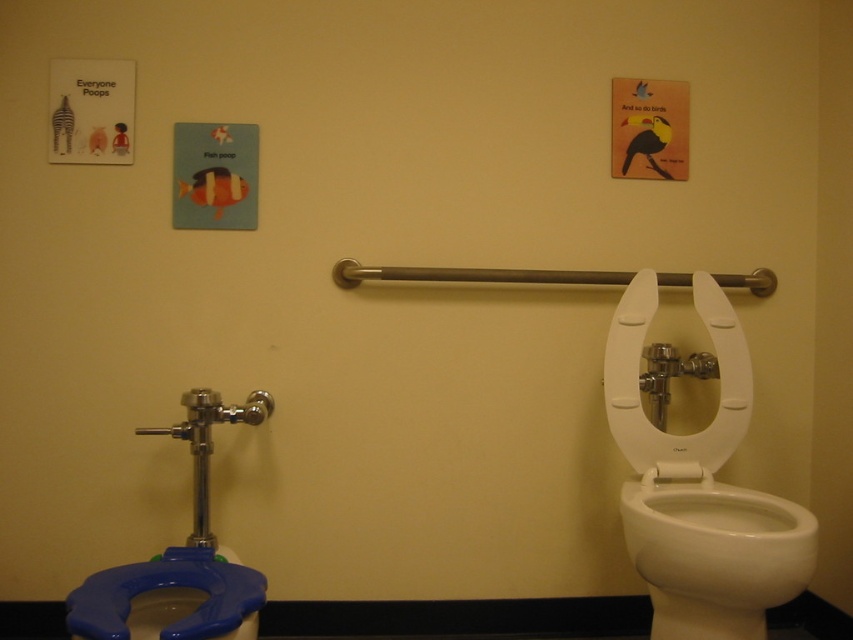
You are a maintenance worker checking the restroom. You need to access the blue plastic toilet paper at lower left. Is it possible to reach it without moving the white plastic toilet seat at right?

The blue plastic toilet paper at lower left is behind the white plastic toilet seat at right, so you cannot reach it without moving the white plastic toilet seat at right.

You are a person standing in the restroom and want to reach the blue plastic toilet paper at lower left. Can you easily access it without moving the white glossy toilet bowl at right?

The white glossy toilet bowl at right is in front of the blue plastic toilet paper at lower left, so it might block your access. You might need to move the toilet bowl to reach it, but since toilets are fixed in place, you can try reaching around or bending down to access the toilet paper without moving the toilet bowl.